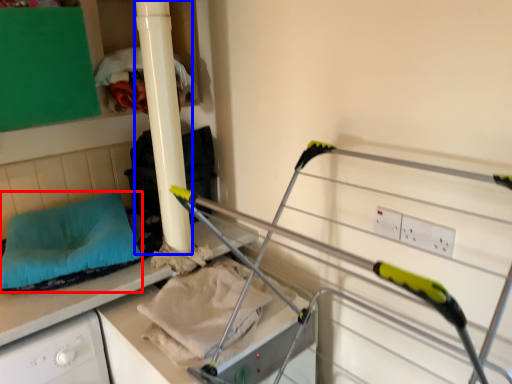
Question: Which object is further to the camera taking this photo, pillow (highlighted by a red box) or pillar (highlighted by a blue box)?

Choices:
 (A) pillow
 (B) pillar

Answer: (A)